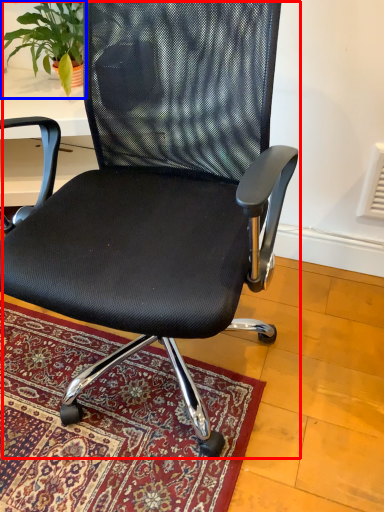
Question: Which of the following is the farthest to the observer, chair (highlighted by a red box) or houseplant (highlighted by a blue box)?

Choices:
 (A) chair
 (B) houseplant

Answer: (B)